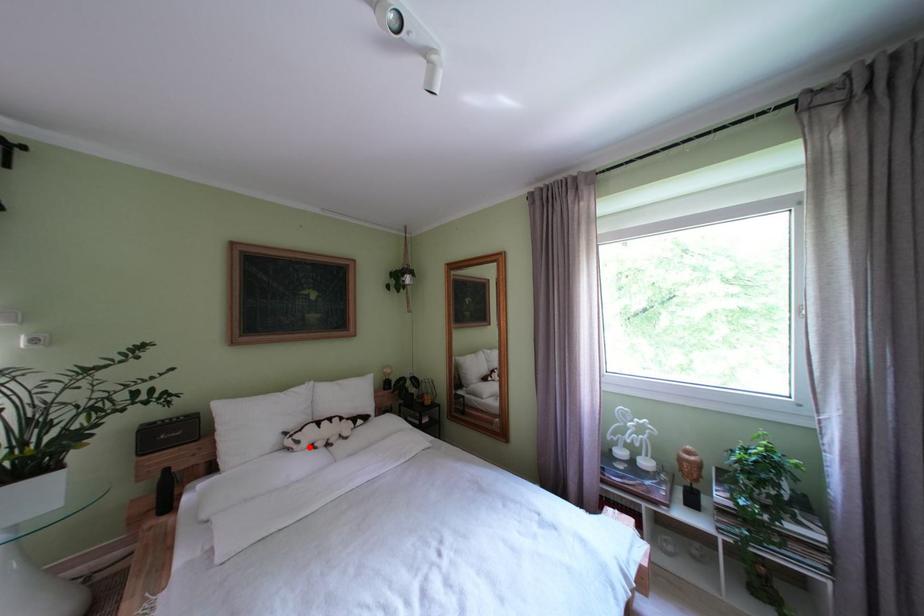
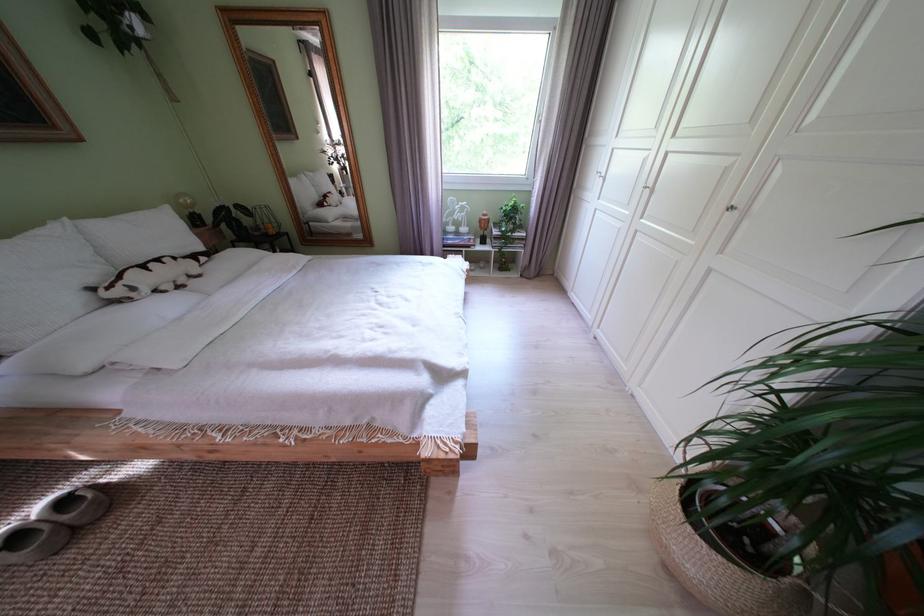
In the second image, find the point that corresponds to the highlighted location in the first image.

(146, 294)